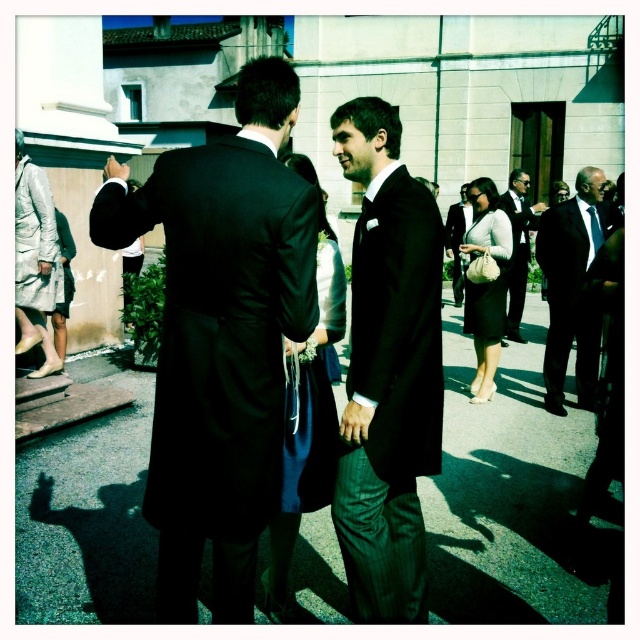
Question: Is black pinstripe suit at center bigger than black silk suit at center?

Choices:
 (A) no
 (B) yes

Answer: (A)

Question: Which point is farther to the camera?

Choices:
 (A) silky blue dress at center
 (B) black pinstripe suit at center
 (C) matte black dress at center
 (D) smooth asphalt pavement at center

Answer: (C)

Question: Can you confirm if matte black suit at left is positioned below black silk suit at center?

Choices:
 (A) yes
 (B) no

Answer: (A)

Question: Which point is closer to the camera taking this photo?

Choices:
 (A) (563, 330)
 (B) (476, 301)
 (C) (364, 172)
 (D) (460, 211)

Answer: (C)

Question: Which object is the closest to the black wool suit at center?

Choices:
 (A) matte black suit at left
 (B) black pinstripe suit at right
 (C) matte black dress at center

Answer: (C)

Question: Is matte black dress at center to the right of black silk suit at center from the viewer's perspective?

Choices:
 (A) no
 (B) yes

Answer: (A)